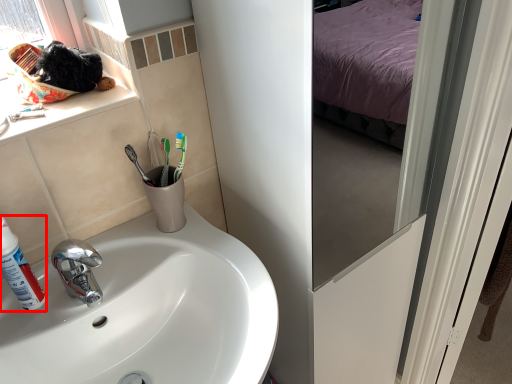
Question: In this image, where is shaving cream (annotated by the red box) located relative to sink?

Choices:
 (A) right
 (B) left

Answer: (B)